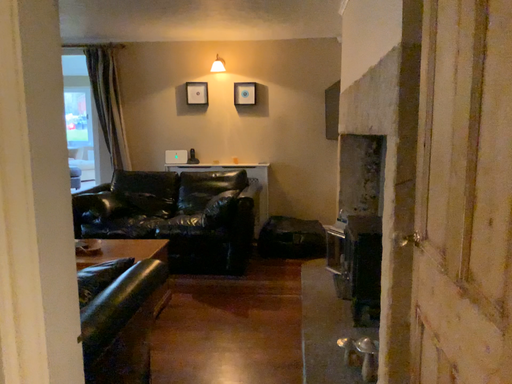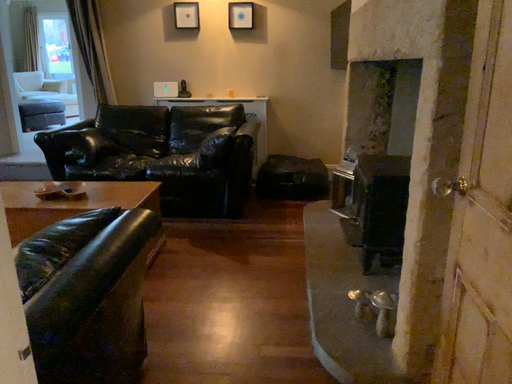
Question: Which way did the camera rotate in the video?

Choices:
 (A) rotated downward
 (B) rotated upward

Answer: (A)